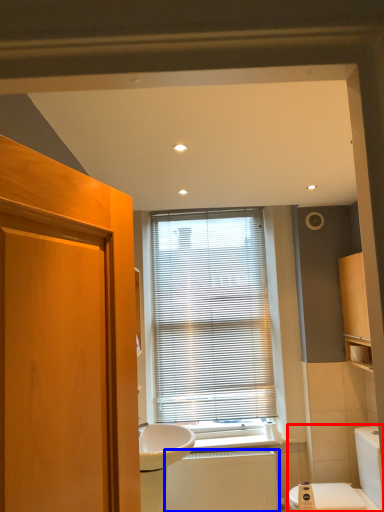
Question: Which point is further to the camera, toilet (highlighted by a red box) or radiator (highlighted by a blue box)?

Choices:
 (A) toilet
 (B) radiator

Answer: (B)